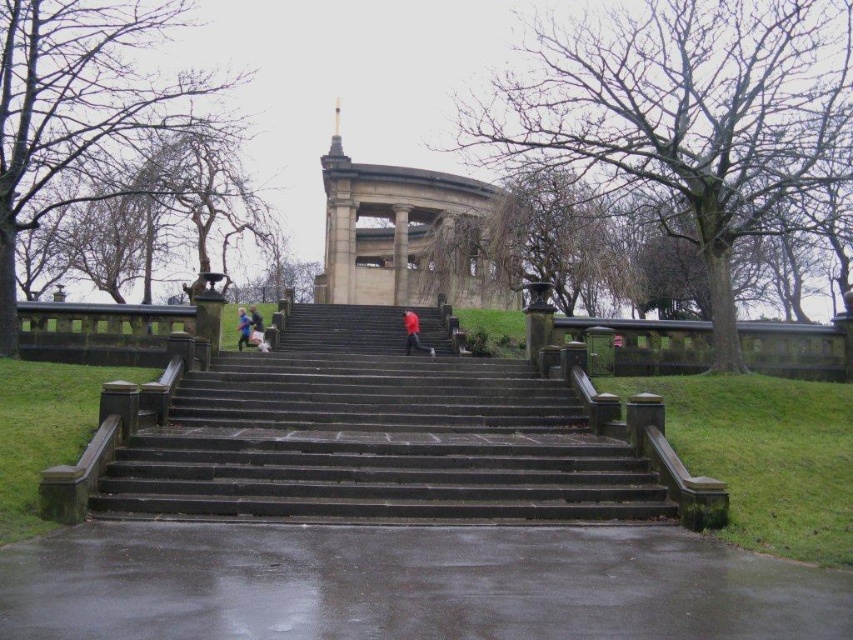
Question: Which point is closer to the camera?

Choices:
 (A) (463, 513)
 (B) (413, 337)

Answer: (A)

Question: Which is farther from the red jacket at center?

Choices:
 (A) red matte jacket at center
 (B) dark stone stairs at center

Answer: (B)

Question: Is dark stone stairs at center thinner than red jacket at center?

Choices:
 (A) no
 (B) yes

Answer: (A)

Question: Which of the following is the farthest from the observer?

Choices:
 (A) stone gazebo at center
 (B) dark stone stairs at center
 (C) red matte jacket at center

Answer: (A)

Question: Is stone gazebo at center to the right of red jacket at center from the viewer's perspective?

Choices:
 (A) no
 (B) yes

Answer: (B)

Question: Is stone gazebo at center to the right of red jacket at center from the viewer's perspective?

Choices:
 (A) yes
 (B) no

Answer: (A)